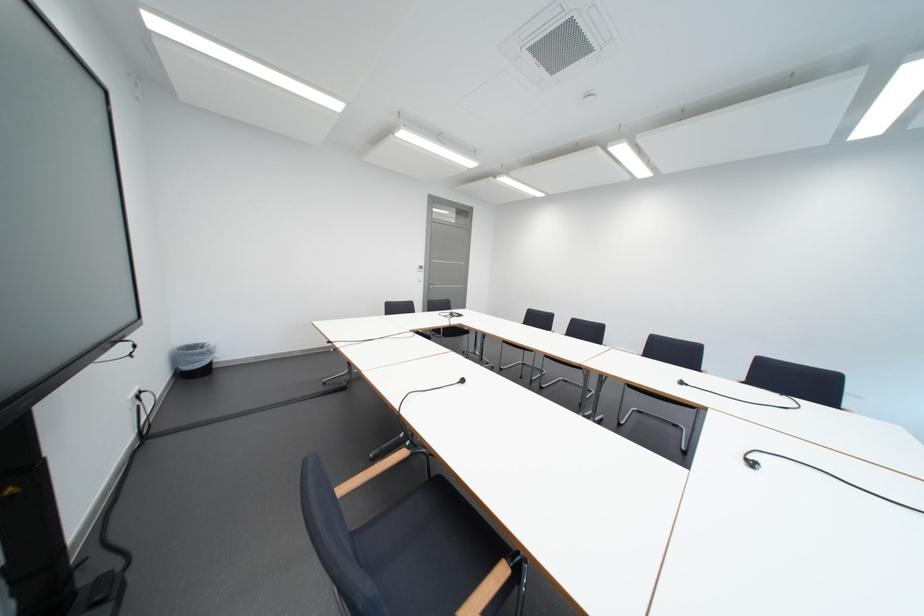
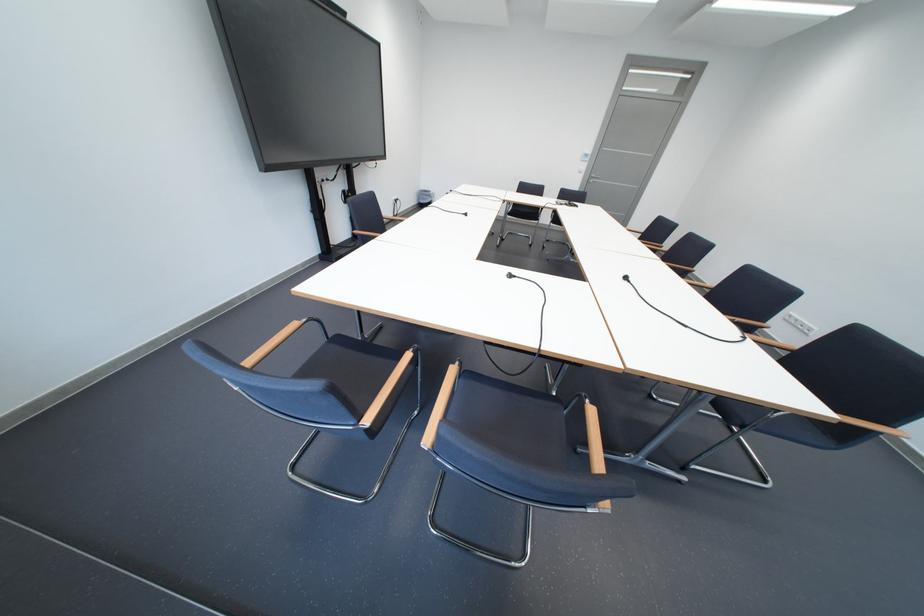
Find the pixel in the second image that matches point (433, 278) in the first image.

(596, 168)